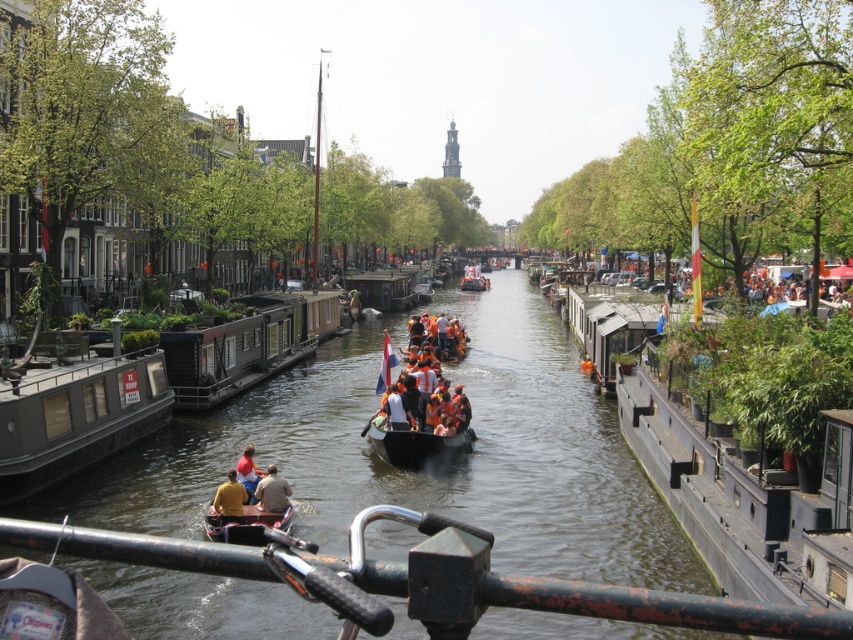
Question: Which point is closer to the camera taking this photo?

Choices:
 (A) (228, 497)
 (B) (397, 282)
 (C) (248, 461)
 (D) (387, 460)

Answer: (A)

Question: Is yellow fabric at lower center to the right of orange fabric person at center from the viewer's perspective?

Choices:
 (A) yes
 (B) no

Answer: (B)

Question: Can you confirm if orange life jackets at center is positioned above yellow fabric at lower center?

Choices:
 (A) yes
 (B) no

Answer: (A)

Question: Which object appears farthest from the camera in this image?

Choices:
 (A) wooden boat at center
 (B) brown leather jacket at center
 (C) rusty metal rail at lower center

Answer: (A)

Question: Estimate the real-world distances between objects in this image. Which object is farther from the orange life jackets at center?

Choices:
 (A) dark gray matte houseboat at left
 (B) wooden boat at center
 (C) orange fabric person at center
 (D) yellow fabric at lower center

Answer: (B)

Question: Is orange life jackets at center thinner than brown leather jacket at center?

Choices:
 (A) yes
 (B) no

Answer: (B)